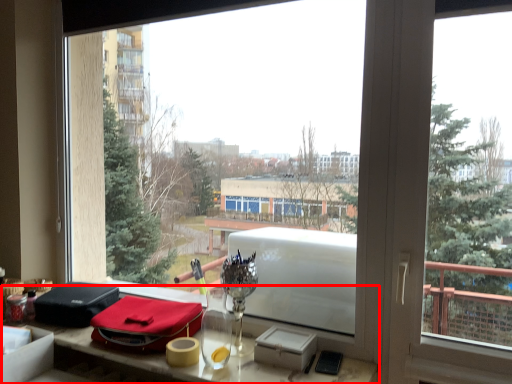
Question: Where is table (annotated by the red box) located in relation to material in the image?

Choices:
 (A) right
 (B) left

Answer: (A)